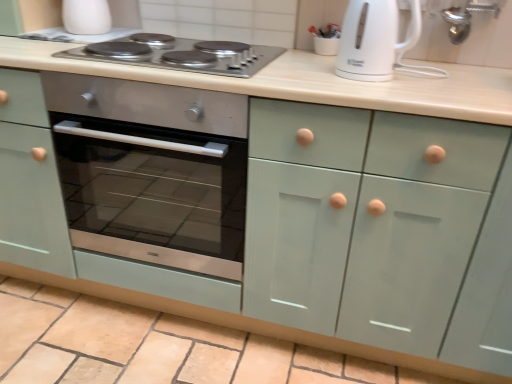
This screenshot has height=384, width=512. Identify the location of free spot to the right of white glossy cup at upper left. (123, 43).